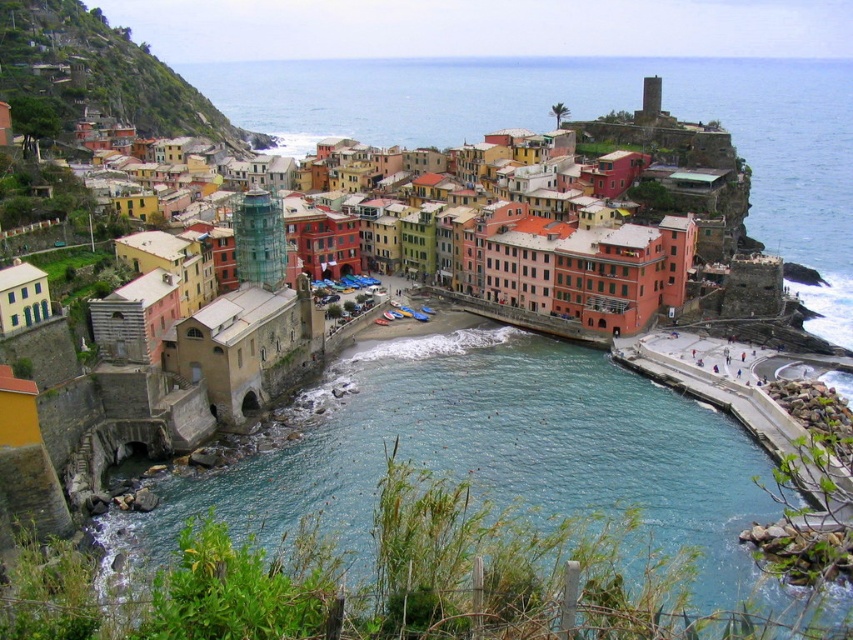
Question: Can you confirm if multicolored buildings at center is smaller than multicolored buildings at upper left?

Choices:
 (A) no
 (B) yes

Answer: (B)

Question: Which point is farther to the camera?

Choices:
 (A) (587, 452)
 (B) (183, 122)
 (C) (569, 307)

Answer: (B)

Question: Which point is farther to the camera?

Choices:
 (A) multicolored buildings at center
 (B) blue water at center

Answer: (A)

Question: Among these objects, which one is farthest from the camera?

Choices:
 (A) blue water at center
 (B) multicolored buildings at upper left

Answer: (B)

Question: Is multicolored buildings at center behind multicolored buildings at upper left?

Choices:
 (A) no
 (B) yes

Answer: (A)

Question: Does multicolored buildings at center have a lesser width compared to multicolored buildings at upper left?

Choices:
 (A) yes
 (B) no

Answer: (B)